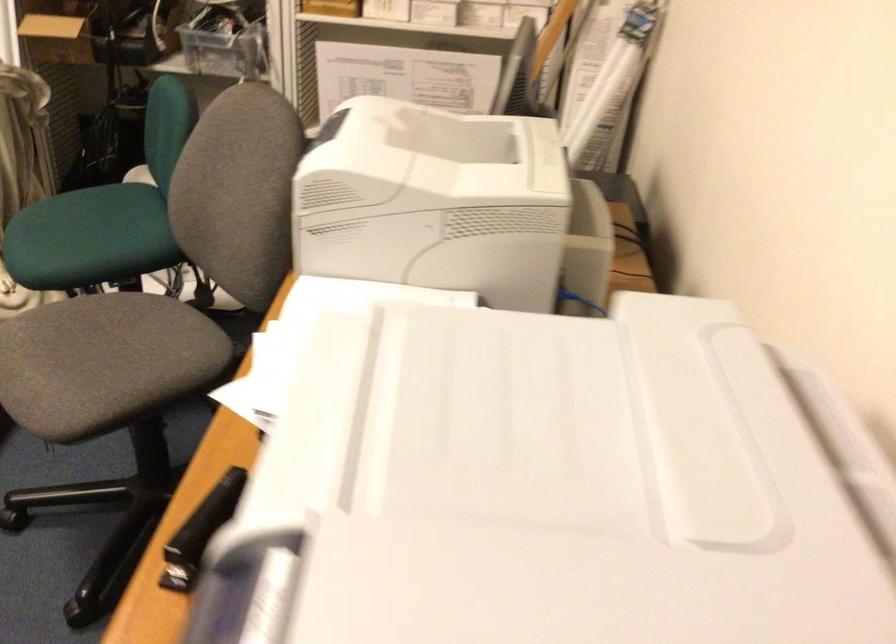
Find where to sit the gray chair sitting surface. Please return your answer as a coordinate pair (x, y).

(105, 363)